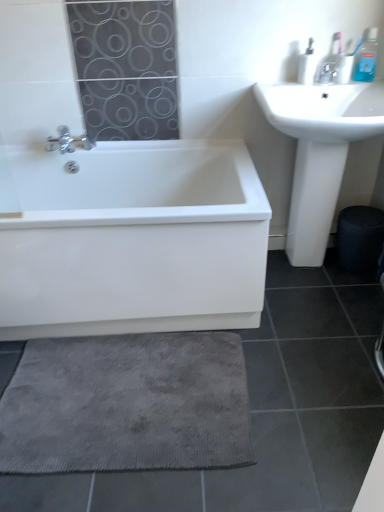
You are a GUI agent. You are given a task and a screenshot of the screen. Output one action in this format:
    pyautogui.click(x=<x>, y=<y>)
    Task: Click on the free space above gray textured bath mat at lower center (from a real-world perspective)
    This screenshot has height=512, width=384.
    Given the screenshot: What is the action you would take?
    pyautogui.click(x=129, y=398)